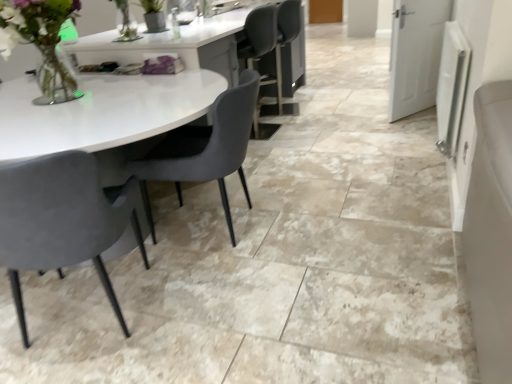
Question: Is matte gray chair at left, the second chair from the right, inside the boundaries of velvet grey chair at center, the 2th chair in the left-to-right sequence, or outside?

Choices:
 (A) inside
 (B) outside

Answer: (B)

Question: In the image, is matte gray chair at left, which is counted as the 1th chair, starting from the left, positioned in front of or behind velvet grey chair at center, which is the 1th chair from right to left?

Choices:
 (A) behind
 (B) front

Answer: (B)

Question: Estimate the real-world distances between objects in this image. Which object is farther from the matte gray chair at left, which is counted as the 1th chair, starting from the left?

Choices:
 (A) translucent glass vase at upper left
 (B) velvet grey chair at center, the 2th chair in the left-to-right sequence

Answer: (A)

Question: Which of these objects is positioned closest to the translucent glass vase at upper left?

Choices:
 (A) velvet grey chair at center, the 2th chair in the left-to-right sequence
 (B) matte gray chair at left, the second chair from the right

Answer: (A)